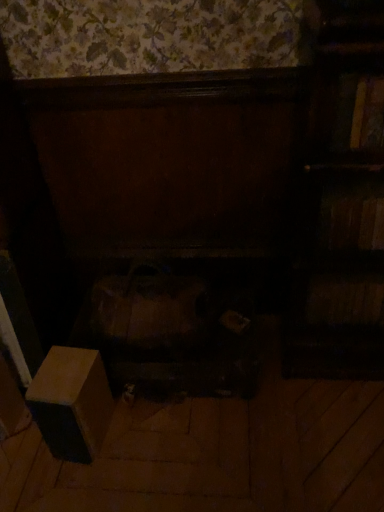
Locate an element on the screen. Image resolution: width=384 pixels, height=512 pixels. free space in front of matte brown cardboard box at lower left is located at coordinates coord(81,483).